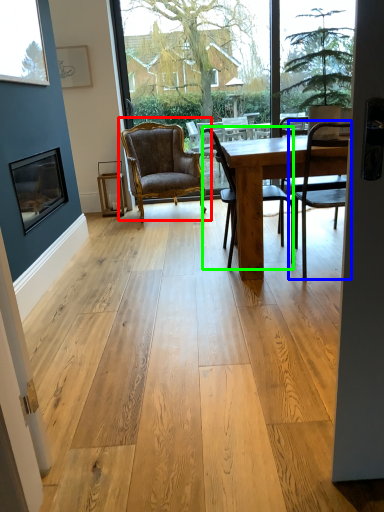
Question: Considering the real-world distances, which object is closest to chair (highlighted by a red box)? chair (highlighted by a blue box) or chair (highlighted by a green box).

Choices:
 (A) chair
 (B) chair

Answer: (B)